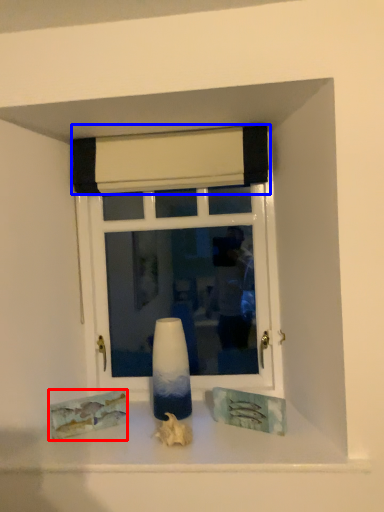
Question: Which object appears farthest to the camera in this image, art (highlighted by a red box) or curtain (highlighted by a blue box)?

Choices:
 (A) art
 (B) curtain

Answer: (B)